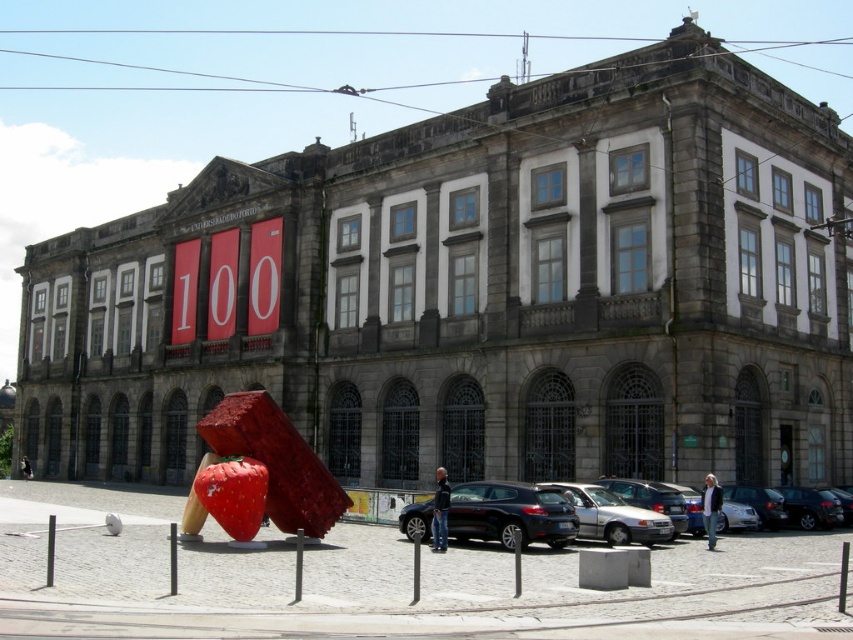
You are standing in front of the historic building and want to take a photo of both the silver metallic car at lower center and the shiny black car at center. Which car should you move closer to in order to include both in the frame?

You should move closer to the shiny black car at center because the silver metallic car at lower center is already closer to you, so adjusting your position towards the farther car will help include both in the frame.